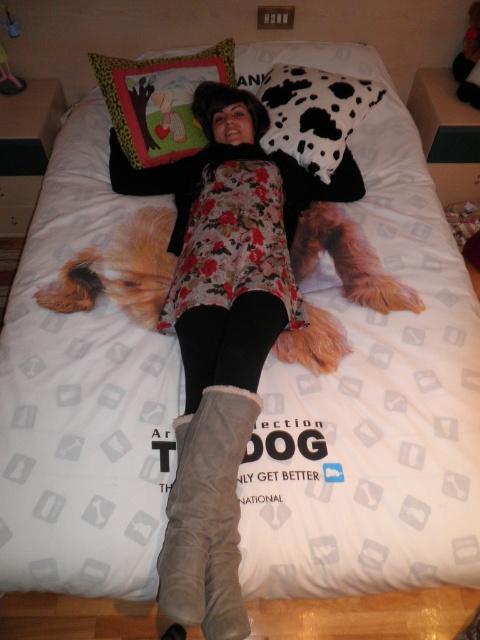
You are a photographer setting up a shoot in this room. You need to place a rectangular backdrop that is 2 feet wide between the suede boots at lower center and the leopard print fabric pillow at upper left. Will the backdrop fit between them?

The suede boots at lower center has a lesser width compared to leopard print fabric pillow at upper left. Since the backdrop is 2 feet wide, but the width comparison between the objects is not provided, we cannot determine if the backdrop will fit. Please provide more details about the distance between the objects.

You are standing in the room and want to reach the point at coordinates point [155,93]. If you can move 6 feet in one go, can you reach it without needing to stop?

The distance between you and the point [155,93] is 5.71 feet. Since you can move 6 feet in one go, you can reach it without needing to stop.

You are a photographer standing in front of the bed. You want to take a closeup photo of the leopard print fabric pillow at upper left without moving the camera. Can you fit the entire pillow into the frame?

The leopard print fabric pillow at upper left is 1.71 meters from camera. Since the pillow is positioned at this distance, it may be too far to capture the entire pillow in the frame without moving closer or using a zoom lens.